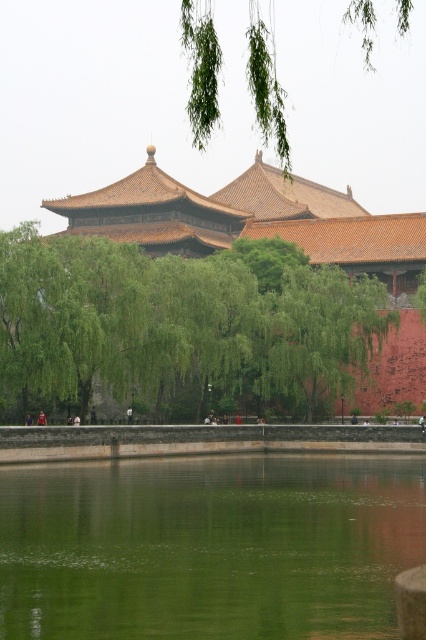
Is green leafy tree at center bigger than green leafy branches at upper center?

No.

Measure the distance between point (333, 321) and camera.

The distance of point (333, 321) from camera is 315.04 feet.

Which is in front, point (307, 358) or point (411, 1)?

Point (307, 358) is in front.

This screenshot has width=426, height=640. What are the coordinates of `green leafy tree at center` in the screenshot? It's located at (178, 323).

From the picture: Is green reflective water at center behind green leafy branches at upper center?

Yes.

The height and width of the screenshot is (640, 426). I want to click on green reflective water at center, so click(209, 547).

This screenshot has height=640, width=426. What are the coordinates of `green reflective water at center` in the screenshot? It's located at (209, 547).

Which of these two, green reflective water at center or green leafy tree at center, stands taller?

green leafy tree at center is taller.

Is point (138, 484) farther from viewer compared to point (262, 305)?

No, (138, 484) is in front of (262, 305).

The image size is (426, 640). Identify the location of green reflective water at center. (209, 547).